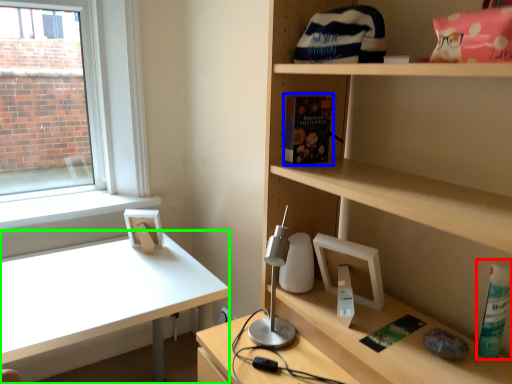
Question: Which object is positioned farthest from bottle (highlighted by a red box)? Select from book (highlighted by a blue box) and desk (highlighted by a green box).

Choices:
 (A) book
 (B) desk

Answer: (B)